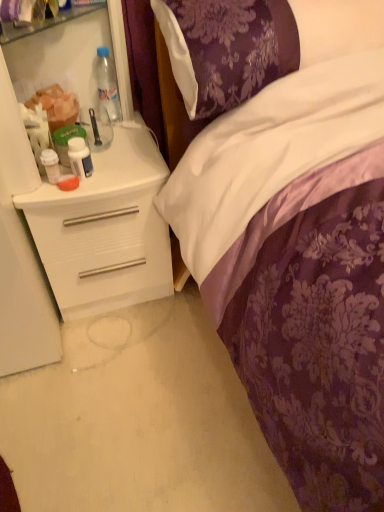
You are a GUI agent. You are given a task and a screenshot of the screen. Output one action in this format:
    pyautogui.click(x=<x>, y=<y>)
    Task: Click on the vacant space behind white glossy pill bottle at left, which is the 2th bottle from top to bottom
    The image size is (384, 512).
    Given the screenshot: What is the action you would take?
    pyautogui.click(x=116, y=147)